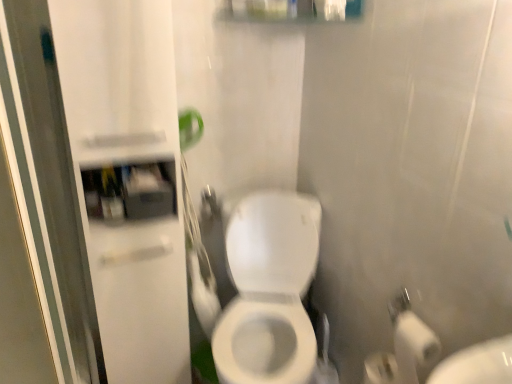
Question: Is white glossy toilet at center inside or outside of white glossy cabinet at left, arranged as the first screen door when viewed from the right?

Choices:
 (A) inside
 (B) outside

Answer: (B)

Question: Is point (246, 278) closer or farther from the camera than point (96, 274)?

Choices:
 (A) farther
 (B) closer

Answer: (A)

Question: Estimate the real-world distances between objects in this image. Which object is farther from the matte plastic medicine cabinet at upper left?

Choices:
 (A) transparent glass screen door at left, arranged as the 1th screen door when viewed from the left
 (B) white glossy toilet at center
 (C) white glossy cabinet at left, the 2th screen door positioned from the left

Answer: (B)

Question: Which of these objects is positioned closest to the white glossy toilet at center?

Choices:
 (A) white glossy cabinet at left, arranged as the first screen door when viewed from the right
 (B) matte plastic medicine cabinet at upper left
 (C) transparent glass screen door at left, arranged as the 1th screen door when viewed from the left

Answer: (A)